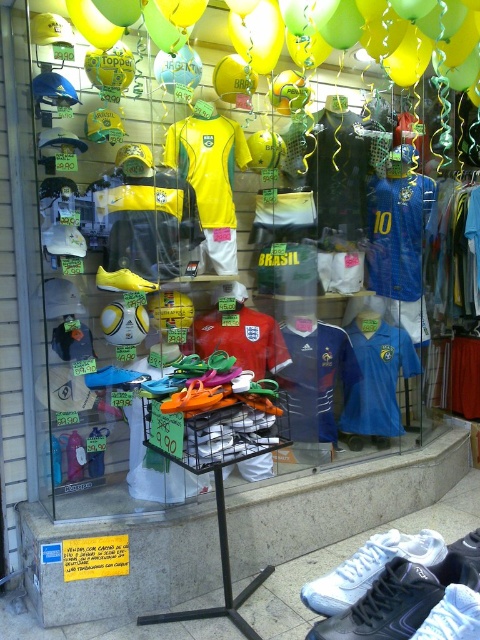
Can you confirm if white mesh shoe at lower right is positioned to the right of white synthetic shoe at lower right?

No, white mesh shoe at lower right is not to the right of white synthetic shoe at lower right.

Does white mesh shoe at lower right have a greater height compared to white synthetic shoe at lower right?

Yes.

The width and height of the screenshot is (480, 640). What do you see at coordinates (370, 568) in the screenshot?
I see `white mesh shoe at lower right` at bounding box center [370, 568].

This screenshot has width=480, height=640. I want to click on white mesh shoe at lower right, so click(x=370, y=568).

Locate an element on the screen. This screenshot has height=640, width=480. white mesh shoe at lower right is located at coordinates (370, 568).

Between point (386, 541) and point (100, 275), which one is positioned in front?

Positioned in front is point (386, 541).

Is point (328, 584) positioned after point (103, 285)?

That is False.

Where is `white mesh shoe at lower right`? Image resolution: width=480 pixels, height=640 pixels. white mesh shoe at lower right is located at coordinates (370, 568).

Is white synthetic shoe at lower right to the right of yellow matte soccer shoe at center from the viewer's perspective?

Yes, white synthetic shoe at lower right is to the right of yellow matte soccer shoe at center.

This screenshot has width=480, height=640. I want to click on white synthetic shoe at lower right, so click(x=453, y=616).

Where is `white synthetic shoe at lower right`? Image resolution: width=480 pixels, height=640 pixels. white synthetic shoe at lower right is located at coordinates (453, 616).